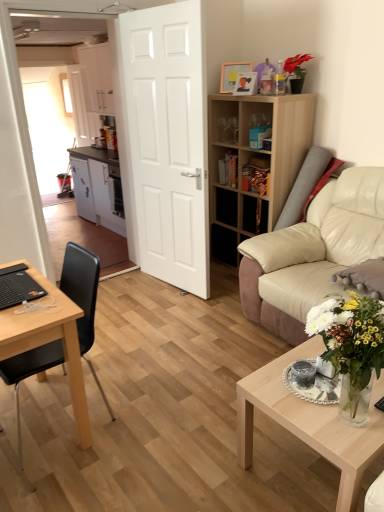
Question: Is wooden picture frame at upper center, which is the first picture frame in back-to-front order, at the left side of black plastic chair at left?

Choices:
 (A) yes
 (B) no

Answer: (B)

Question: From a real-world perspective, is wooden picture frame at upper center, which is the first picture frame in back-to-front order, physically below black plastic chair at left?

Choices:
 (A) yes
 (B) no

Answer: (B)

Question: From a real-world perspective, is wooden picture frame at upper center, marked as the second picture frame in a front-to-back arrangement, positioned over black plastic chair at left based on gravity?

Choices:
 (A) no
 (B) yes

Answer: (B)

Question: Is wooden picture frame at upper center, which is the first picture frame in back-to-front order, wider than black plastic chair at left?

Choices:
 (A) yes
 (B) no

Answer: (B)

Question: Can you confirm if wooden picture frame at upper center, which is the first picture frame in back-to-front order, is shorter than black plastic chair at left?

Choices:
 (A) no
 (B) yes

Answer: (B)

Question: Does wooden picture frame at upper center, which is the first picture frame in back-to-front order, have a lesser width compared to black plastic chair at left?

Choices:
 (A) no
 (B) yes

Answer: (B)

Question: From the image's perspective, is white glossy vase at lower right above white matte cabinet at center, the first cabinetry positioned from the top?

Choices:
 (A) no
 (B) yes

Answer: (A)

Question: Is white glossy vase at lower right wider than white matte cabinet at center, which is the second cabinetry from bottom to top?

Choices:
 (A) no
 (B) yes

Answer: (A)

Question: From a real-world perspective, is white glossy vase at lower right physically below white matte cabinet at center, the first cabinetry positioned from the top?

Choices:
 (A) yes
 (B) no

Answer: (A)

Question: Considering the relative sizes of white glossy vase at lower right and white matte cabinet at center, the first cabinetry positioned from the top, in the image provided, is white glossy vase at lower right shorter than white matte cabinet at center, the first cabinetry positioned from the top,?

Choices:
 (A) yes
 (B) no

Answer: (A)

Question: Is white glossy vase at lower right oriented towards white matte cabinet at center, which is the second cabinetry from bottom to top?

Choices:
 (A) no
 (B) yes

Answer: (A)

Question: Is white glossy vase at lower right in front of white matte cabinet at center, the first cabinetry positioned from the top?

Choices:
 (A) no
 (B) yes

Answer: (B)

Question: Is white glossy vase at lower right far away from white matte cabinet at left, the 2th cabinetry in the top-to-bottom sequence?

Choices:
 (A) yes
 (B) no

Answer: (A)